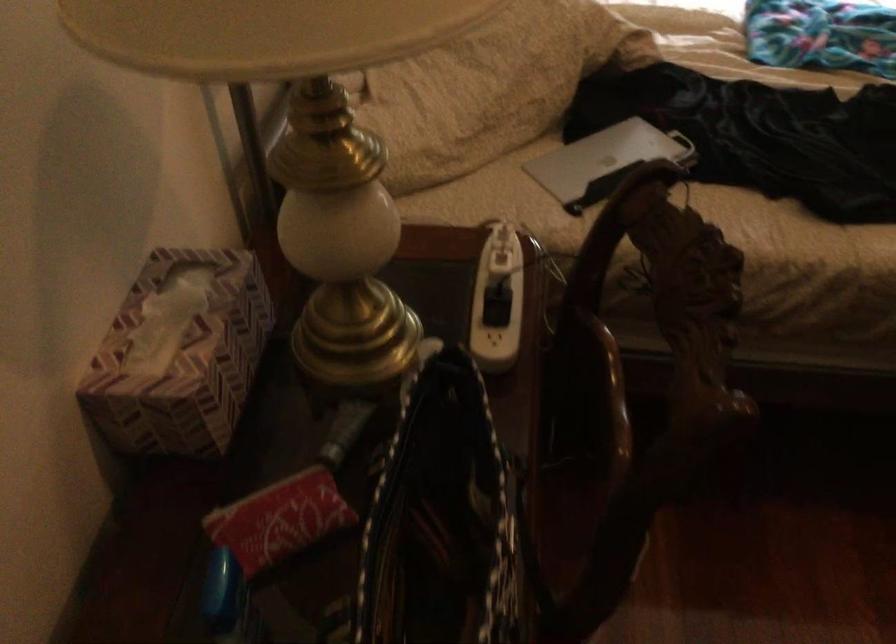
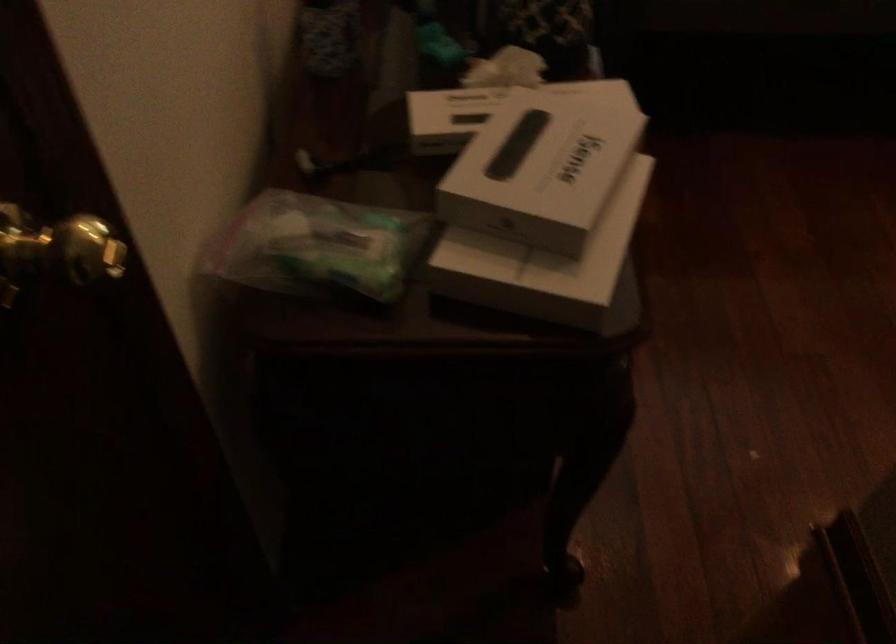
Question: Based on the continuous images, in which direction is the camera rotating? Reply with the corresponding letter.

Choices:
 (A) Left
 (B) Right
 (C) Up
 (D) Down

Answer: (D)